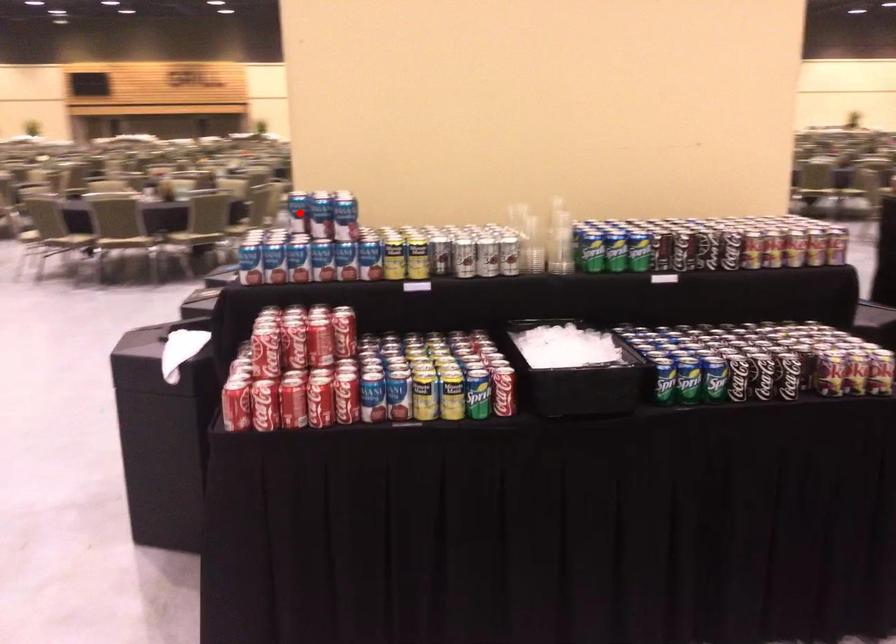
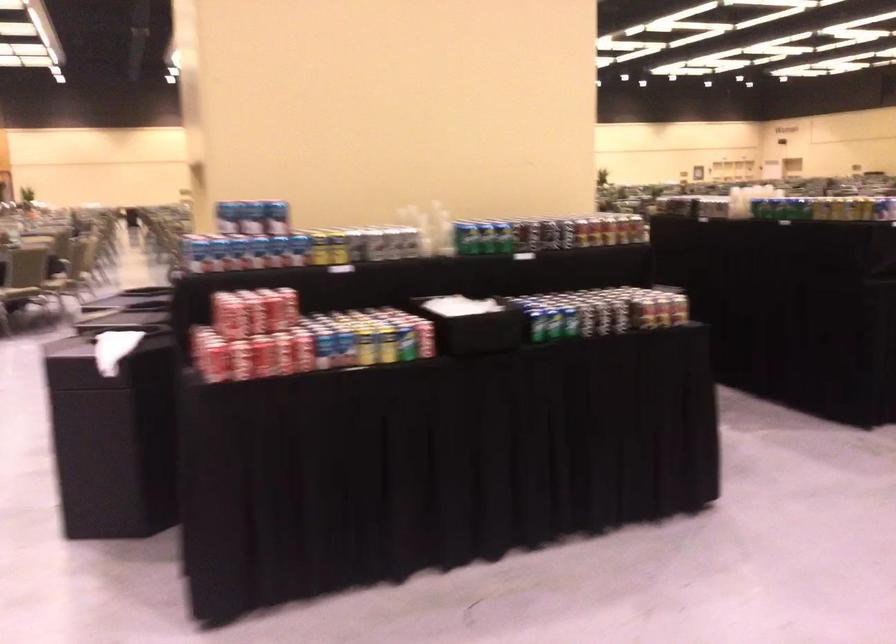
Question: I am providing you with two images of the same scene from different viewpoints. A red point is shown in image1. For the corresponding object point in image2, is it positioned nearer or farther from the camera?

Choices:
 (A) Nearer
 (B) Farther

Answer: (B)